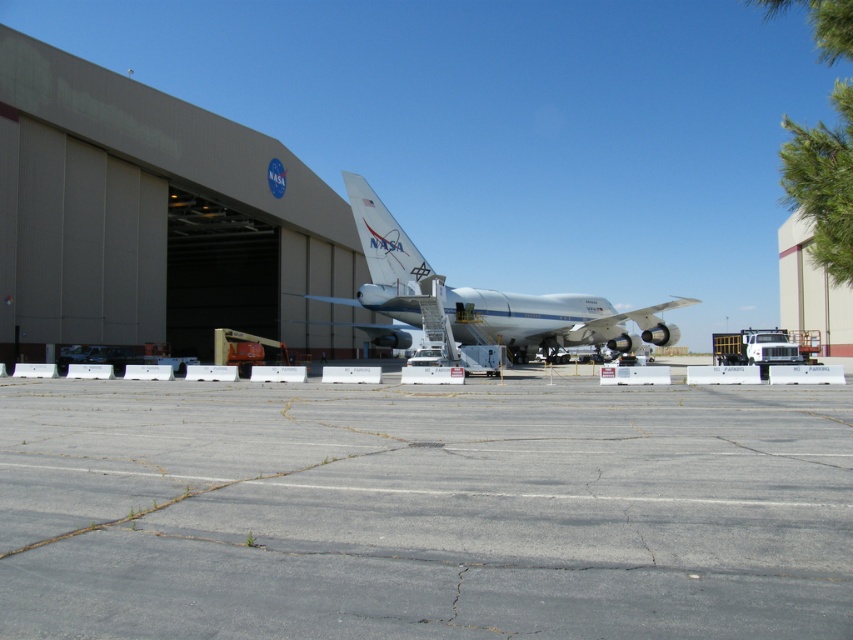
You are standing at the point marked by the coordinates point (424, 509) in the image. Based on the scene description, what surface are you currently standing on?

The point (424, 509) marks gray asphalt tarmac at center, so you are standing on gray asphalt tarmac at center.

You are standing at the entrance of the NASA hangar and see two points marked on the ground. The first point is at coordinate point (0, 595) and the second is at point (657, 337). If you want to move from the first point to the second point, which direction should you face to walk towards the second point?

To move from point (0, 595) to point (657, 337), you should face northwest because the second point is located to the northwest of the first point.